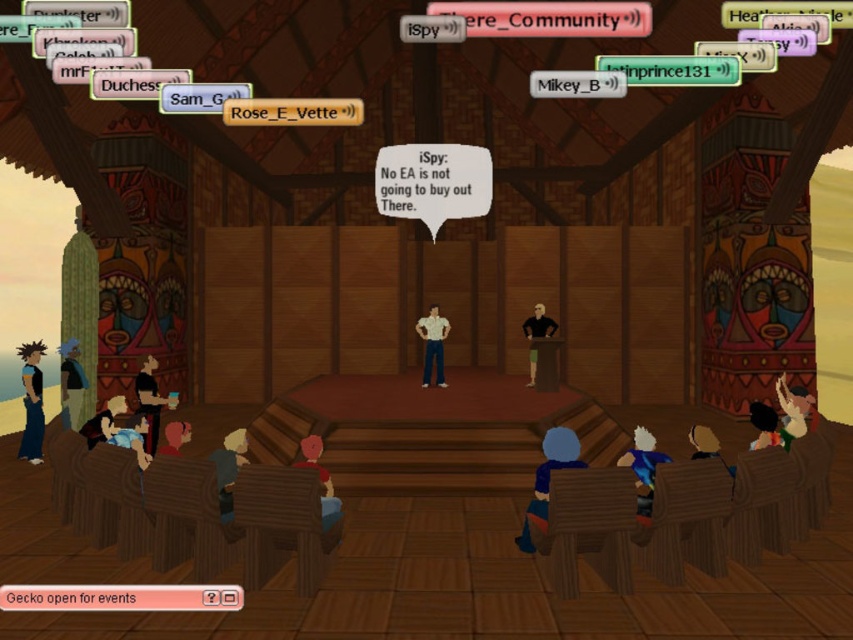
Who is more distant from viewer, (641, 484) or (428, 317)?

Positioned behind is point (428, 317).

Does point (647, 500) come in front of point (419, 323)?

That is True.

The image size is (853, 640). What are the coordinates of `blue fabric shirt at lower right` in the screenshot? It's located at (643, 465).

Can you confirm if shiny blue hair at lower left is taller than green fabric shirt at lower right?

Indeed, shiny blue hair at lower left has a greater height compared to green fabric shirt at lower right.

Is shiny blue hair at lower left bigger than green fabric shirt at lower right?

Yes.

Locate an element on the screen. The width and height of the screenshot is (853, 640). shiny blue hair at lower left is located at coordinates (32, 403).

At what (x,y) coordinates should I click in order to perform the action: click on blue fabric shirt at left. Please return your answer as a coordinate pair (x, y). This screenshot has height=640, width=853. Looking at the image, I should click on (71, 385).

Measure the distance between point (61, 380) and camera.

The distance of point (61, 380) from camera is 8.79 meters.

Who is more forward, (71, 387) or (434, 376)?

Point (71, 387) is more forward.

At what (x,y) coordinates should I click in order to perform the action: click on blue fabric shirt at left. Please return your answer as a coordinate pair (x, y). The image size is (853, 640). Looking at the image, I should click on (71, 385).